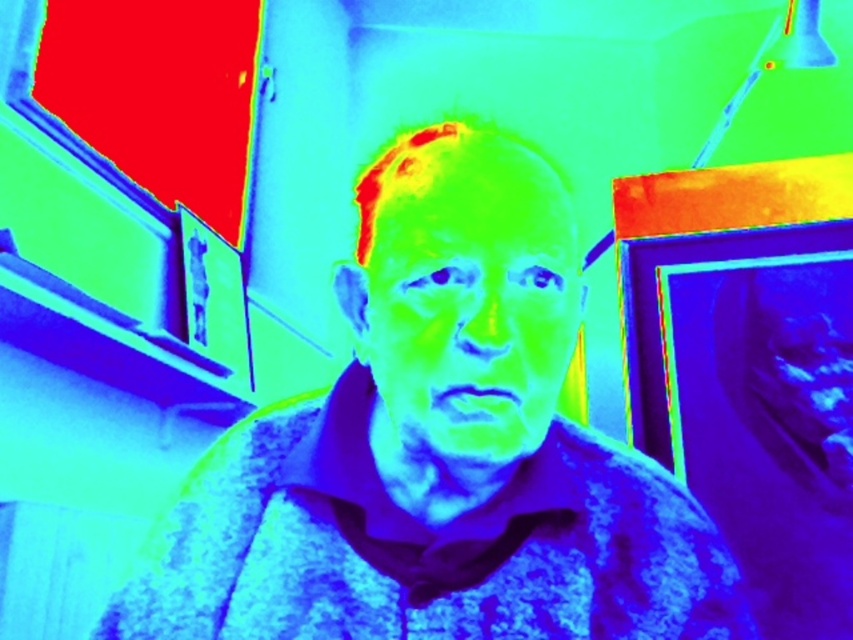
In the thermal image, there is a fluffy fabric man at center and a matte skin face at center. Based on their positions, which one is located to the right?

The matte skin face at center is to the right of the fluffy fabric man at center.

You are an artist analyzing the composition of this image. You notice the fluffy fabric man at center and the matte skin face at center. Based on their positions, which one is located lower in the image?

The fluffy fabric man at center is located lower than the matte skin face at center because it is positioned below it.

You are an artist analyzing the image. You notice the fluffy fabric man at center and the matte skin face at center. Which object occupies a larger vertical space in the image?

The fluffy fabric man at center is much taller than the matte skin face at center, so it occupies a larger vertical space in the image.